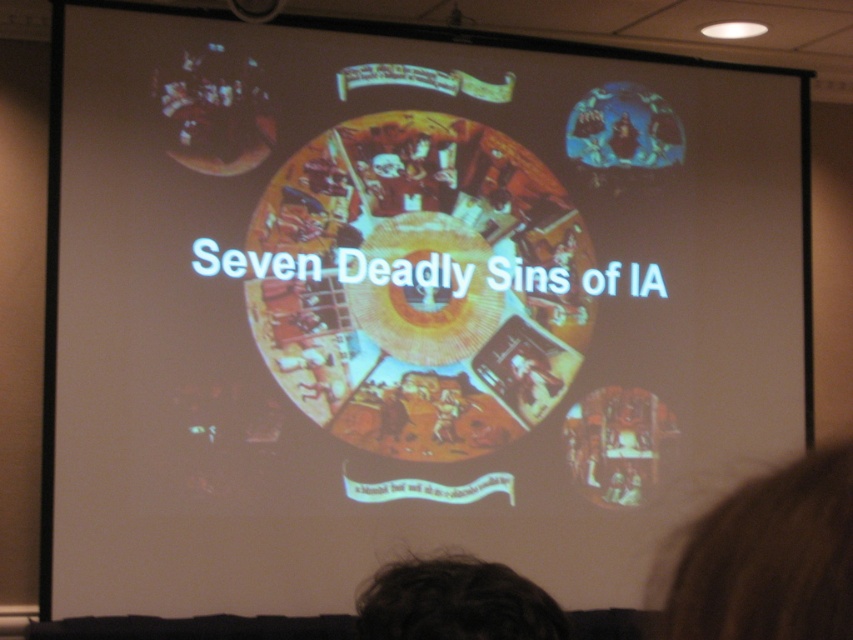
Question: Is brown fuzzy hair at lower right thinner than dark hair at lower center?

Choices:
 (A) yes
 (B) no

Answer: (A)

Question: Which object appears closest to the camera in this image?

Choices:
 (A) dark hair at lower center
 (B) brown fuzzy hair at lower right

Answer: (B)

Question: From the image, what is the correct spatial relationship of brown fuzzy hair at lower right in relation to dark hair at lower center?

Choices:
 (A) below
 (B) above

Answer: (B)

Question: Among these points, which one is farthest from the camera?

Choices:
 (A) (425, 636)
 (B) (785, 589)

Answer: (A)

Question: Which point is farther from the camera taking this photo?

Choices:
 (A) (741, 628)
 (B) (438, 566)

Answer: (B)

Question: Does brown fuzzy hair at lower right appear on the right side of dark hair at lower center?

Choices:
 (A) yes
 (B) no

Answer: (A)